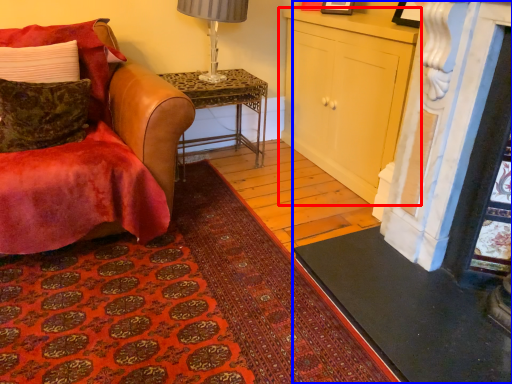
Question: Which point is further to the camera, cabinetry (highlighted by a red box) or fireplace (highlighted by a blue box)?

Choices:
 (A) cabinetry
 (B) fireplace

Answer: (A)